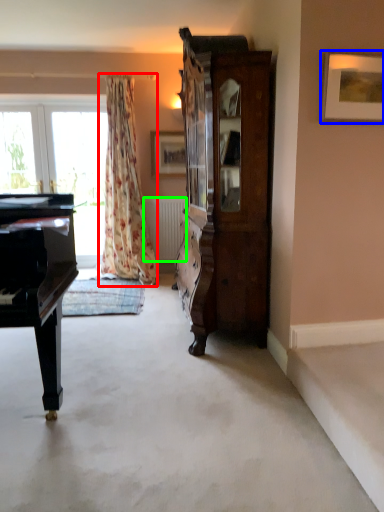
Question: Based on their relative distances, which object is farther from curtain (highlighted by a red box)? Choose from picture frame (highlighted by a blue box) and radiator (highlighted by a green box).

Choices:
 (A) picture frame
 (B) radiator

Answer: (A)